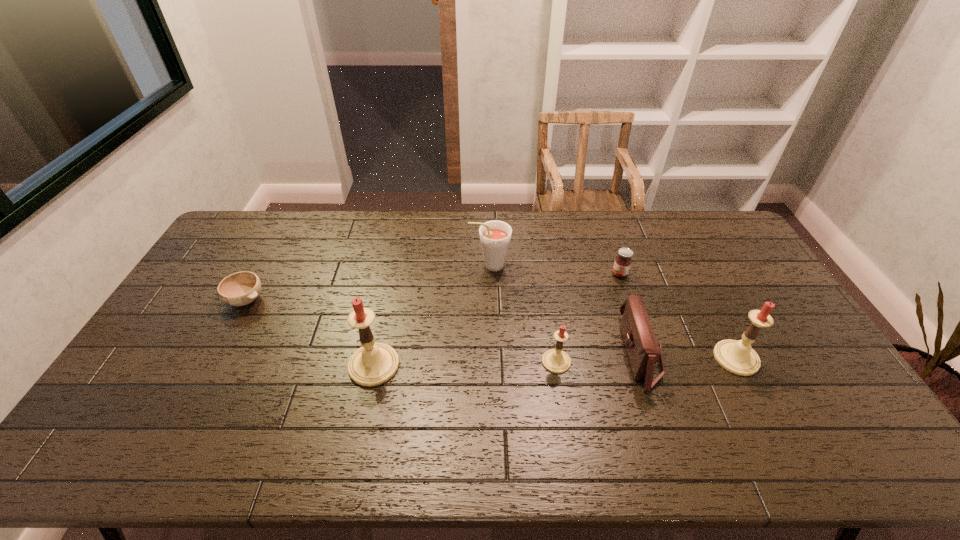
The height and width of the screenshot is (540, 960). I want to click on vacant area situated on the right of the leftmost candle, so click(x=443, y=365).

This screenshot has width=960, height=540. I want to click on vacant space located on the right of the second candle from right to left, so click(628, 362).

This screenshot has width=960, height=540. I want to click on vacant space located 0.110m on the front of the rightmost candle, so click(764, 413).

The image size is (960, 540). Identify the location of free space located on the back of the third farthest object. (274, 251).

Locate an element on the screen. vacant region located 0.070m on the drink side of the fifth object from right to left is located at coordinates (449, 265).

I want to click on blank space located 0.160m on the drink side of the fifth object from right to left, so click(423, 265).

Locate an element on the screen. vacant space located on the drink side of the fifth object from right to left is located at coordinates (354, 265).

Find the location of a particular element. free point located 0.240m on the front flap of the shoulder bag is located at coordinates (539, 353).

At what (x,y) coordinates should I click in order to perform the action: click on vacant space positioned on the front flap of the shoulder bag. Please return your answer as a coordinate pair (x, y). Looking at the image, I should click on (521, 353).

Find the location of a particular element. free region located 0.330m on the front flap of the shoulder bag is located at coordinates (507, 353).